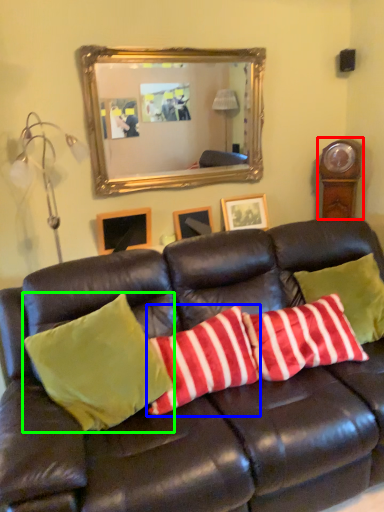
Question: Based on their relative distances, which object is farther from clock (highlighted by a red box)? Choose from pillow (highlighted by a blue box) and pillow (highlighted by a green box).

Choices:
 (A) pillow
 (B) pillow

Answer: (B)